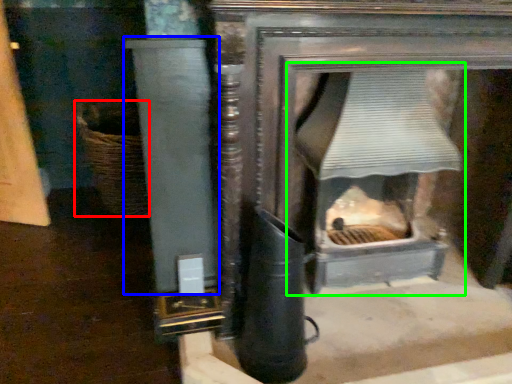
Question: Considering the real-world distances, which object is closest to basket (highlighted by a red box)? pillar (highlighted by a blue box) or fireplace (highlighted by a green box).

Choices:
 (A) pillar
 (B) fireplace

Answer: (A)